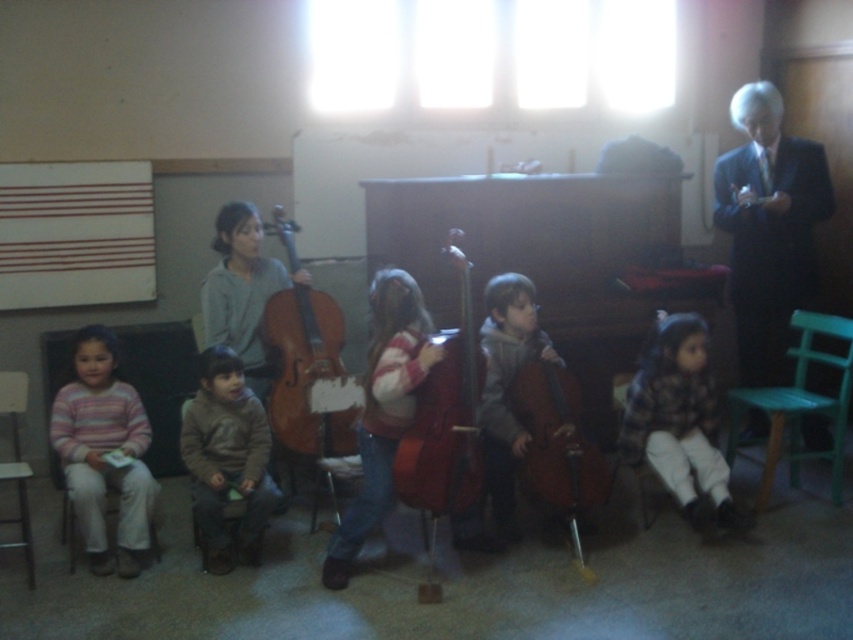
You are a teacher in the classroom and need to store the velvet red cello at center and the gray wool sweater at center in a storage cabinet. The cabinet has two shelves. The top shelf can hold items up to 1 meter in height, and the bottom shelf can hold items up to 1.5 meters in height. Which shelf should each item be placed on?

The velvet red cello at center is bigger than the gray wool sweater at center. Since the bottom shelf can hold items up to 1.5 meters, the velvet red cello at center should be placed there. The gray wool sweater at center, being smaller, can fit on the top shelf which holds up to 1 meter.